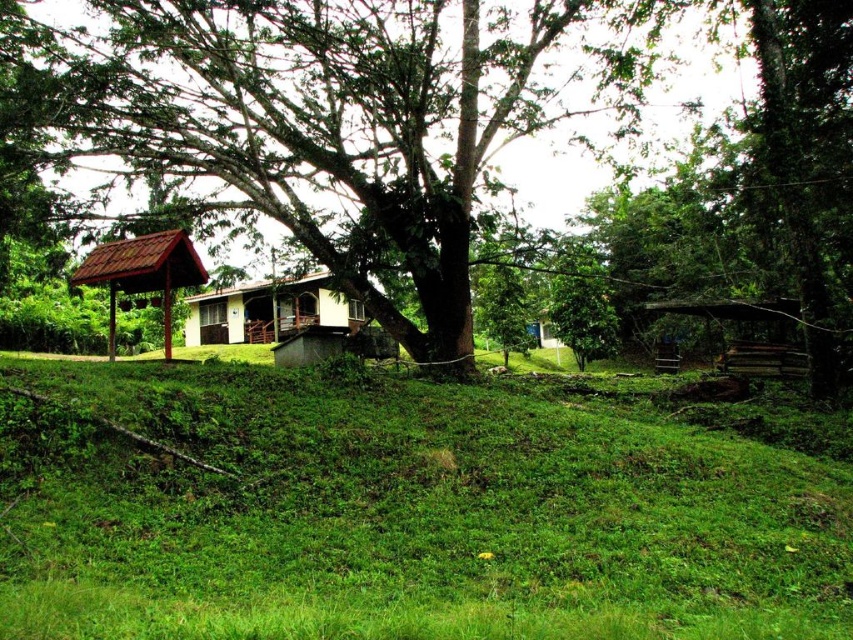
Does green grassy at center appear on the left side of white matte house at center?

In fact, green grassy at center is to the right of white matte house at center.

Is point (604, 593) farther from camera compared to point (230, 333)?

No, (604, 593) is closer to viewer.

The height and width of the screenshot is (640, 853). What are the coordinates of `green grassy at center` in the screenshot? It's located at (399, 513).

Can you confirm if green grassy at center is positioned above matte brown hut at left?

Actually, green grassy at center is below matte brown hut at left.

Is green grassy at center positioned behind matte brown hut at left?

No, it is not.

Who is more distant from viewer, (404, 529) or (178, 282)?

The point (178, 282) is behind.

Where is `green grassy at center`? The width and height of the screenshot is (853, 640). green grassy at center is located at coordinates (399, 513).

Can you confirm if white matte house at center is taller than matte brown hut at left?

In fact, white matte house at center may be shorter than matte brown hut at left.

Can you confirm if white matte house at center is positioned to the right of matte brown hut at left?

Incorrect, white matte house at center is not on the right side of matte brown hut at left.

Where is `white matte house at center`? The width and height of the screenshot is (853, 640). white matte house at center is located at coordinates (270, 310).